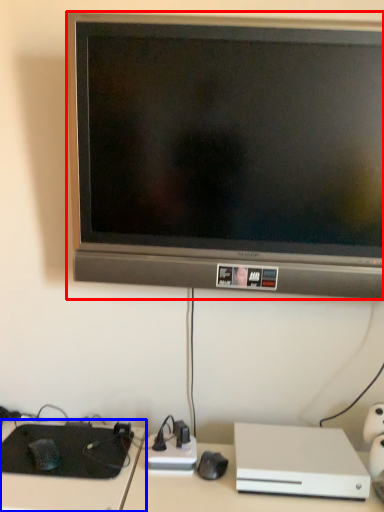
Question: Among these objects, which one is nearest to the camera, television (highlighted by a red box) or computer desk (highlighted by a blue box)?

Choices:
 (A) television
 (B) computer desk

Answer: (A)